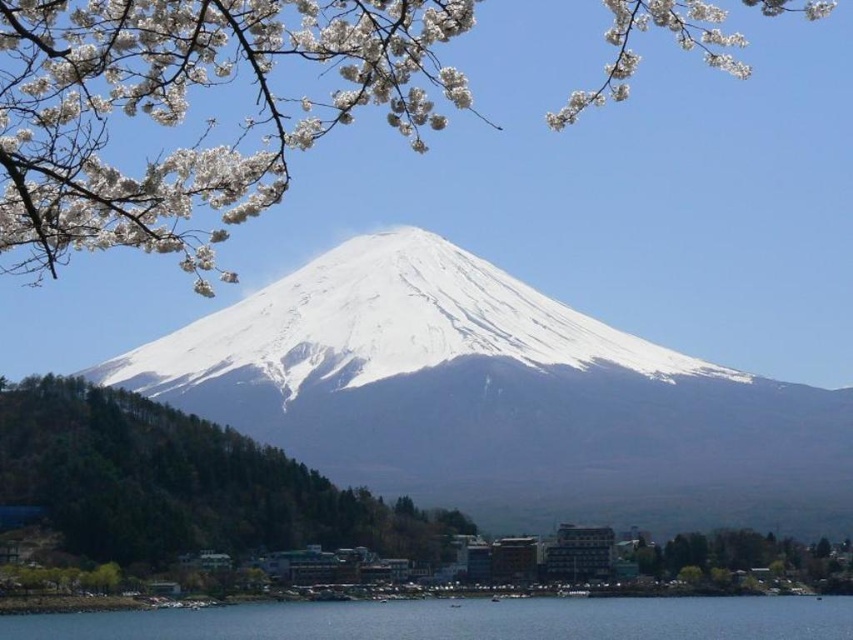
Is white snow-covered mountain at center positioned before green leafy tree at lower left?

That is False.

Does point (398, 467) lie behind point (137, 541)?

Yes, it is behind point (137, 541).

Describe the element at coordinates (498, 397) in the screenshot. I see `white snow-covered mountain at center` at that location.

The height and width of the screenshot is (640, 853). Find the location of `white snow-covered mountain at center`. white snow-covered mountain at center is located at coordinates (498, 397).

Based on the photo, does green leafy tree at lower left appear on the right side of green leafy tree at lower right?

No, green leafy tree at lower left is not to the right of green leafy tree at lower right.

Does green leafy tree at lower left appear under green leafy tree at lower right?

No, green leafy tree at lower left is not below green leafy tree at lower right.

Is point (300, 480) farther from viewer compared to point (674, 577)?

No, it is not.

Find the location of `green leafy tree at lower left`. green leafy tree at lower left is located at coordinates (183, 483).

Is white snow-covered mountain at center taller than clear blue water at lower center?

Yes, white snow-covered mountain at center is taller than clear blue water at lower center.

Does point (573, 369) lie behind point (340, 637)?

Yes.

This screenshot has height=640, width=853. I want to click on white snow-covered mountain at center, so click(498, 397).